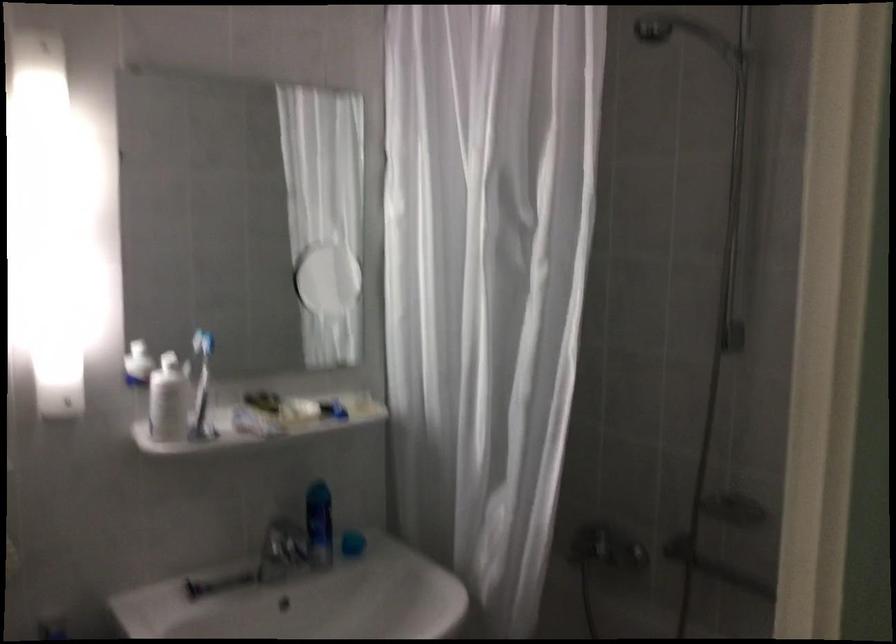
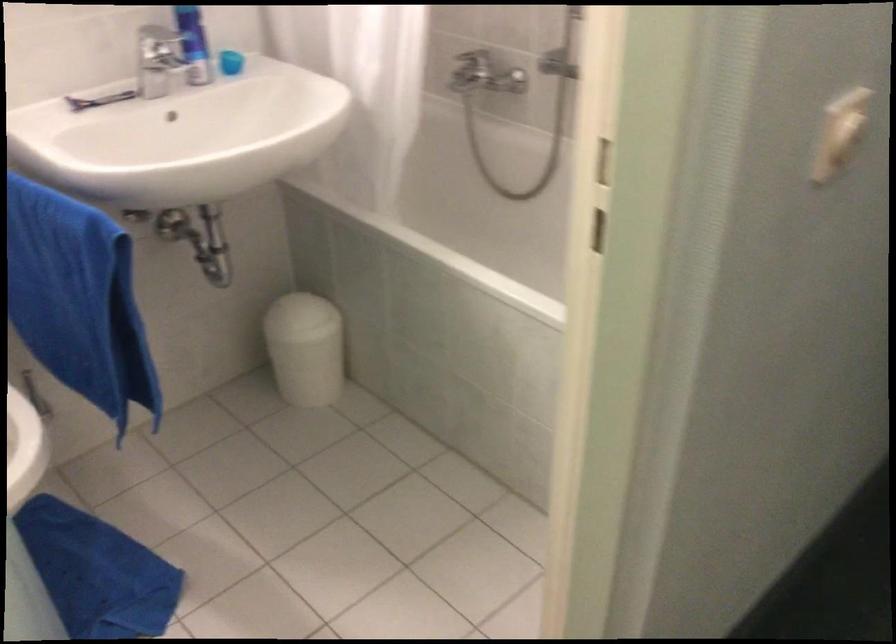
Locate, in the second image, the point that corresponds to (x=350, y=542) in the first image.

(230, 62)